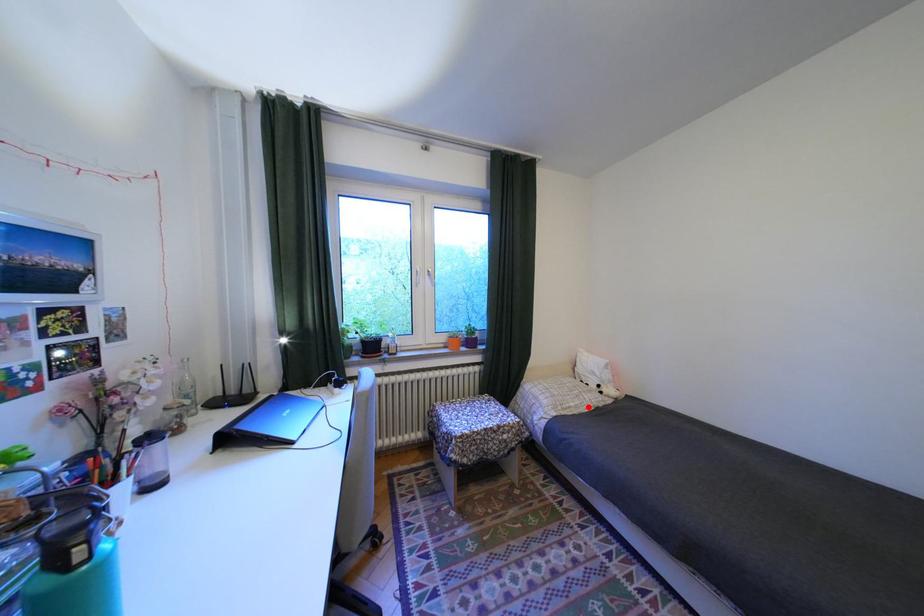
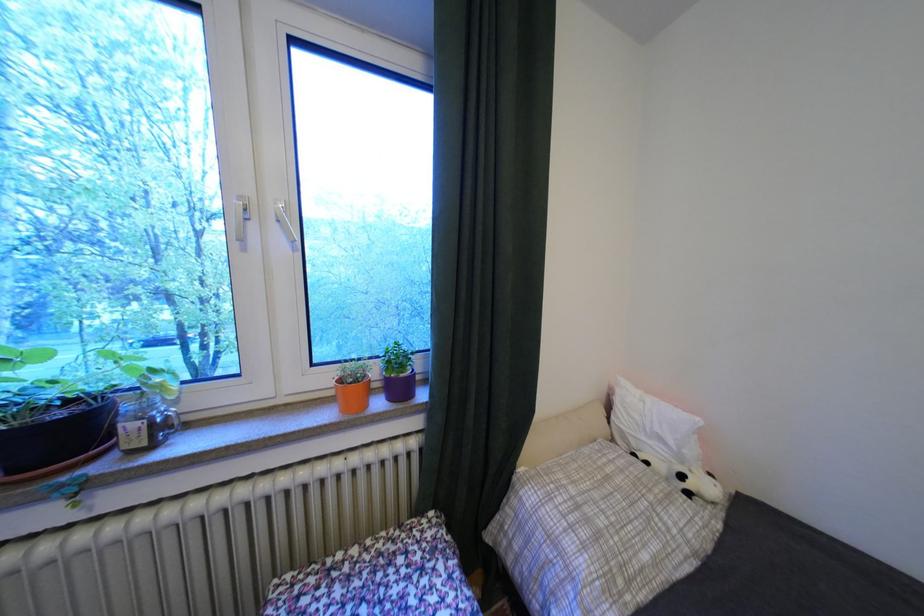
Question: I am providing you with two images of the same scene from different viewpoints. A red point is marked on the first image. At the location where the point appears in image 1, is it still visible in image 2?

Choices:
 (A) Yes
 (B) No

Answer: (A)